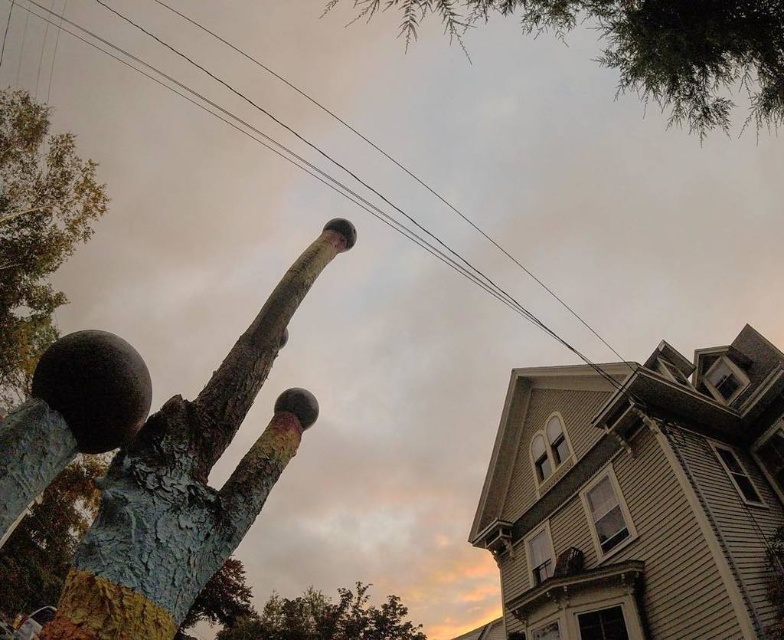
You are an architect designing a new garden layout. You want to place a new bench in the garden such that it is directly below the green textured leaves at upper center. Where should you place the bench in terms of coordinates?

The bench should be placed at the coordinate point directly below the green textured leaves at upper center, which is at point 0.075 on the x and 0.825 on the y axis. Since the bench is to be placed directly below, the x coordinate remains the same, so the bench should be placed at point 0.075 on the x axis and a lower y coordinate than 0.825. However, the exact coordinates depend on the specific layout and dimensions of the garden area.

You are an architect designing a new park layout. You need to place a bench between the green leafy tree at upper left and the green leafy tree at lower center. Which tree should the bench be closer to to ensure it doesn

The bench should be placed closer to the green leafy tree at lower center because it has a greater width than the green leafy tree at upper left, making it a more prominent focal point for the bench placement.

You are an architect designing a garden space. You have to place the rusty metal tree trunk at upper center and the green leafy tree at upper left in your design. Based on their sizes, which one should be placed closer to the entrance to ensure proper visual balance?

The rusty metal tree trunk at upper center is smaller in size compared to the green leafy tree at upper left. To achieve visual balance, the smaller rusty metal tree trunk at upper center should be placed closer to the entrance, while the larger green leafy tree at upper left can be positioned further back.